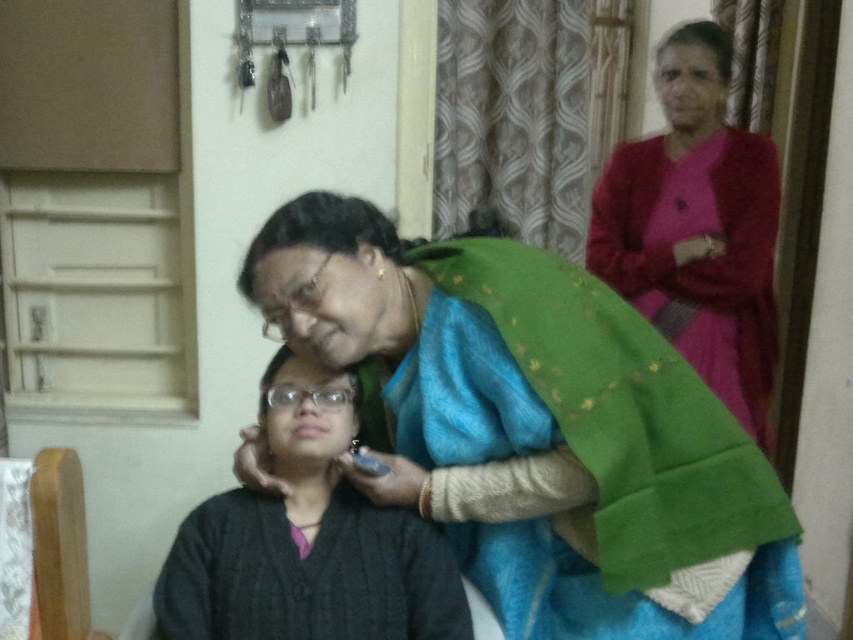
Question: In this image, where is black knitted robe at lower center located relative to matte pink robe at upper right?

Choices:
 (A) left
 (B) right

Answer: (A)

Question: Which of the following is the closest to the observer?

Choices:
 (A) (689, 160)
 (B) (561, 374)

Answer: (B)

Question: Is black knitted robe at lower center wider than matte pink robe at upper right?

Choices:
 (A) no
 (B) yes

Answer: (B)

Question: Is green silk saree at center positioned behind matte pink robe at upper right?

Choices:
 (A) no
 (B) yes

Answer: (A)

Question: Which object is closer to the camera taking this photo?

Choices:
 (A) black knitted robe at lower center
 (B) green silk saree at center

Answer: (B)

Question: Which point is farther to the camera?

Choices:
 (A) matte pink robe at upper right
 (B) black knitted robe at lower center

Answer: (A)